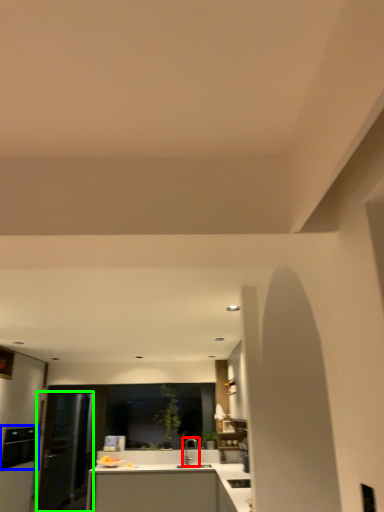
Question: Considering the real-world distances, which object is closest to tap (highlighted by a red box)? appliance (highlighted by a blue box) or glass door (highlighted by a green box).

Choices:
 (A) appliance
 (B) glass door

Answer: (B)